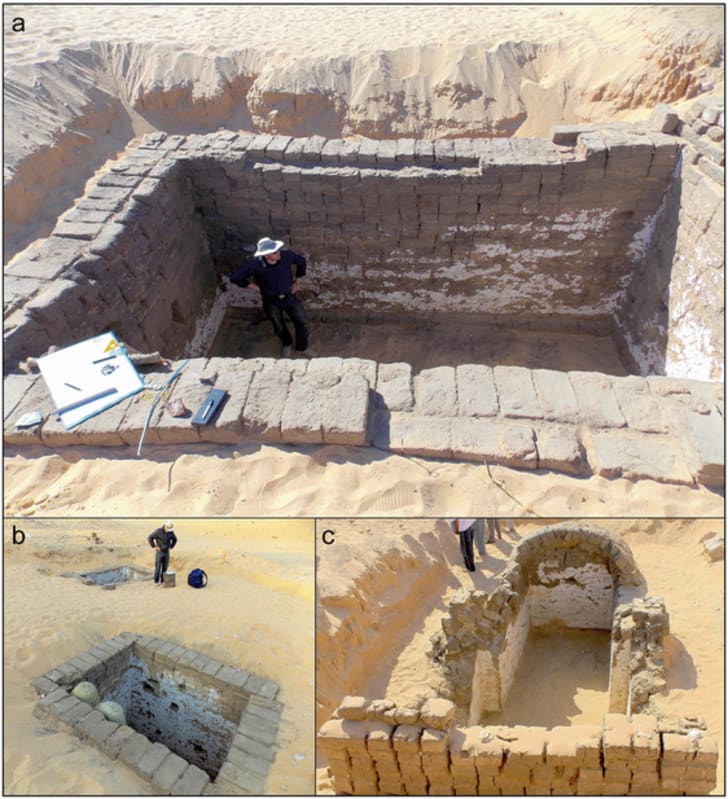
You are a GUI agent. You are given a task and a screenshot of the screen. Output one action in this format:
    pyautogui.click(x=<x>, y=<y>)
    Task: Click on the pen
    The image size is (728, 799).
    Given the screenshot: What is the action you would take?
    pyautogui.click(x=205, y=408)